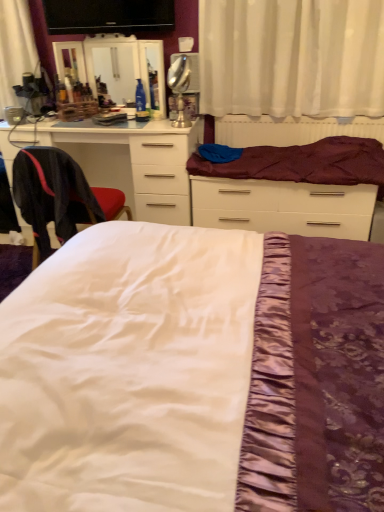
Question: Is silver metallic table lamp at upper center at the right side of purple satin bed at center, placed as the 1th bed when sorted from back to front?

Choices:
 (A) no
 (B) yes

Answer: (A)

Question: Is silver metallic table lamp at upper center facing away from purple satin bed at center, placed as the 1th bed when sorted from back to front?

Choices:
 (A) no
 (B) yes

Answer: (A)

Question: Is silver metallic table lamp at upper center facing towards purple satin bed at center, placed as the 1th bed when sorted from back to front?

Choices:
 (A) yes
 (B) no

Answer: (B)

Question: Is silver metallic table lamp at upper center smaller than purple satin bed at center, placed as the 1th bed when sorted from back to front?

Choices:
 (A) yes
 (B) no

Answer: (A)

Question: Considering the relative sizes of silver metallic table lamp at upper center and purple satin bed at center, placed as the 1th bed when sorted from back to front, in the image provided, is silver metallic table lamp at upper center shorter than purple satin bed at center, placed as the 1th bed when sorted from back to front,?

Choices:
 (A) yes
 (B) no

Answer: (A)

Question: Considering their positions, is white satin bed at center, marked as the first bed in a front-to-back arrangement, located in front of or behind white glossy chest of drawers at left?

Choices:
 (A) front
 (B) behind

Answer: (A)

Question: From the image's perspective, is white satin bed at center, which is counted as the second bed, starting from the back, positioned above or below white glossy chest of drawers at left?

Choices:
 (A) below
 (B) above

Answer: (A)

Question: Visually, is white satin bed at center, marked as the first bed in a front-to-back arrangement, positioned to the left or to the right of white glossy chest of drawers at left?

Choices:
 (A) left
 (B) right

Answer: (B)

Question: In terms of width, does white satin bed at center, which is counted as the second bed, starting from the back, look wider or thinner when compared to white glossy chest of drawers at left?

Choices:
 (A) thin
 (B) wide

Answer: (B)

Question: Considering the positions of maroon satin mattress at upper center and white glossy chest of drawers at left in the image, is maroon satin mattress at upper center wider or thinner than white glossy chest of drawers at left?

Choices:
 (A) wide
 (B) thin

Answer: (B)

Question: Is maroon satin mattress at upper center inside the boundaries of white glossy chest of drawers at left, or outside?

Choices:
 (A) outside
 (B) inside

Answer: (A)

Question: From a real-world perspective, is maroon satin mattress at upper center physically located above or below white glossy chest of drawers at left?

Choices:
 (A) below
 (B) above

Answer: (B)

Question: Considering the positions of maroon satin mattress at upper center and white glossy chest of drawers at left in the image, is maroon satin mattress at upper center taller or shorter than white glossy chest of drawers at left?

Choices:
 (A) short
 (B) tall

Answer: (A)

Question: From a real-world perspective, relative to white satin bed at center, marked as the first bed in a front-to-back arrangement, is black glossy flat-screen tv at upper center vertically above or below?

Choices:
 (A) above
 (B) below

Answer: (A)

Question: Based on their sizes in the image, would you say black glossy flat-screen tv at upper center is bigger or smaller than white satin bed at center, which is counted as the second bed, starting from the back?

Choices:
 (A) big
 (B) small

Answer: (B)